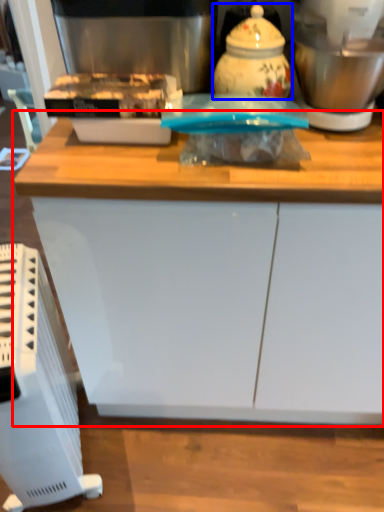
Question: Which point is closer to the camera, cabinetry (highlighted by a red box) or kitchen appliance (highlighted by a blue box)?

Choices:
 (A) cabinetry
 (B) kitchen appliance

Answer: (A)